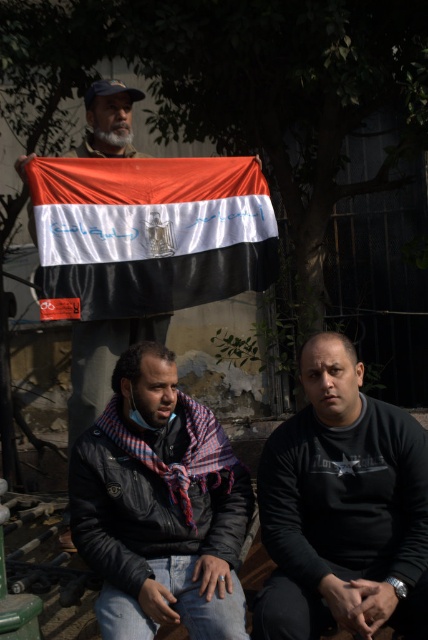
You are standing at the center of the image and want to walk towards the point that is closer to you. Which point should you walk towards, point (83,452) or point (91,108)?

Point (83,452) is in front of point (91,108), so you should walk towards point (83,452) as it is closer to you.

You are a photographer trying to capture a clear image of the black matte shirt at center and the matte fabric flag at upper center. Which object will appear larger in your photo?

The black matte shirt at center will appear larger in the photo because it is closer to the viewer than the matte fabric flag at upper center.